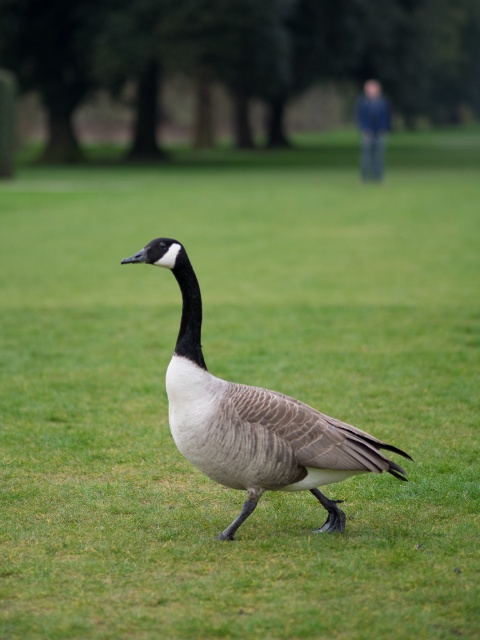
Question: Which of the following is the closest to the observer?

Choices:
 (A) coord(312,417)
 (B) coord(370,124)

Answer: (A)

Question: Can you confirm if gray feathered duck at center is smaller than blue fabric man at upper right?

Choices:
 (A) no
 (B) yes

Answer: (A)

Question: Is gray feathered duck at center thinner than blue fabric man at upper right?

Choices:
 (A) no
 (B) yes

Answer: (A)

Question: Which point is farther to the camera?

Choices:
 (A) (367, 99)
 (B) (272, 458)

Answer: (A)

Question: Can you confirm if gray feathered duck at center is wider than blue fabric man at upper right?

Choices:
 (A) no
 (B) yes

Answer: (B)

Question: Among these points, which one is nearest to the camera?

Choices:
 (A) (372, 132)
 (B) (228, 529)

Answer: (B)